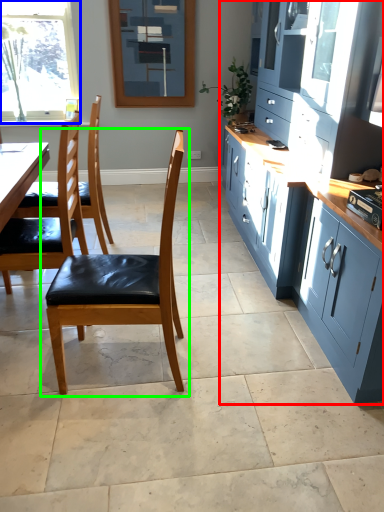
Question: Estimate the real-world distances between objects in this image. Which object is closer to cabinetry (highlighted by a red box), window (highlighted by a blue box) or chair (highlighted by a green box)?

Choices:
 (A) window
 (B) chair

Answer: (B)